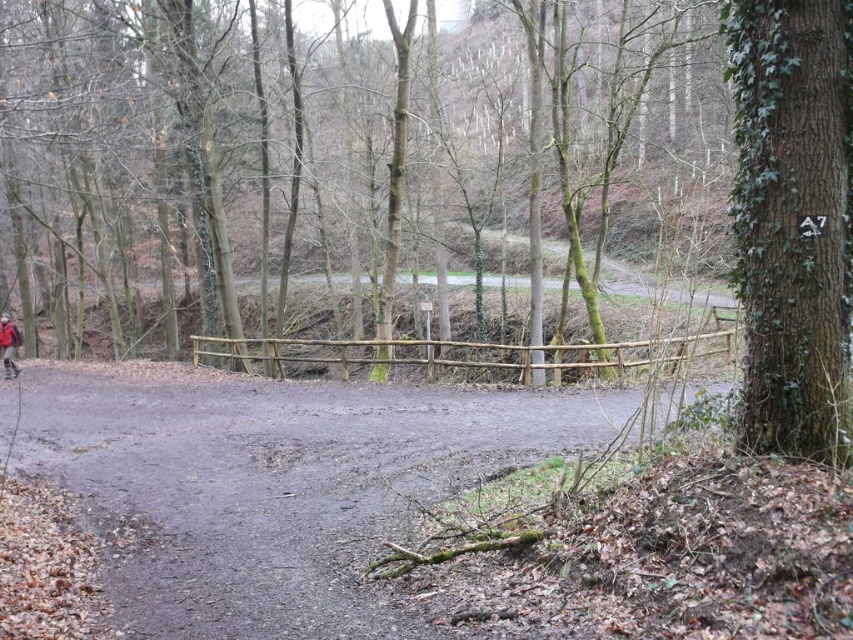
Question: Among these points, which one is nearest to the camera?

Choices:
 (A) (804, 164)
 (B) (15, 362)

Answer: (A)

Question: Is green mossy tree at center behind red jacket at left?

Choices:
 (A) yes
 (B) no

Answer: (B)

Question: Which object appears farthest from the camera in this image?

Choices:
 (A) green ivy-covered tree at right
 (B) green mossy tree at center
 (C) red jacket at left

Answer: (C)

Question: Considering the relative positions of dull gray dirt track at center and red jacket at left in the image provided, where is dull gray dirt track at center located with respect to red jacket at left?

Choices:
 (A) above
 (B) below

Answer: (B)

Question: Can you confirm if green mossy tree at center is positioned to the right of red jacket at left?

Choices:
 (A) no
 (B) yes

Answer: (B)

Question: Which point is farther to the camera?

Choices:
 (A) (811, 352)
 (B) (49, 429)
 (C) (273, 257)

Answer: (C)